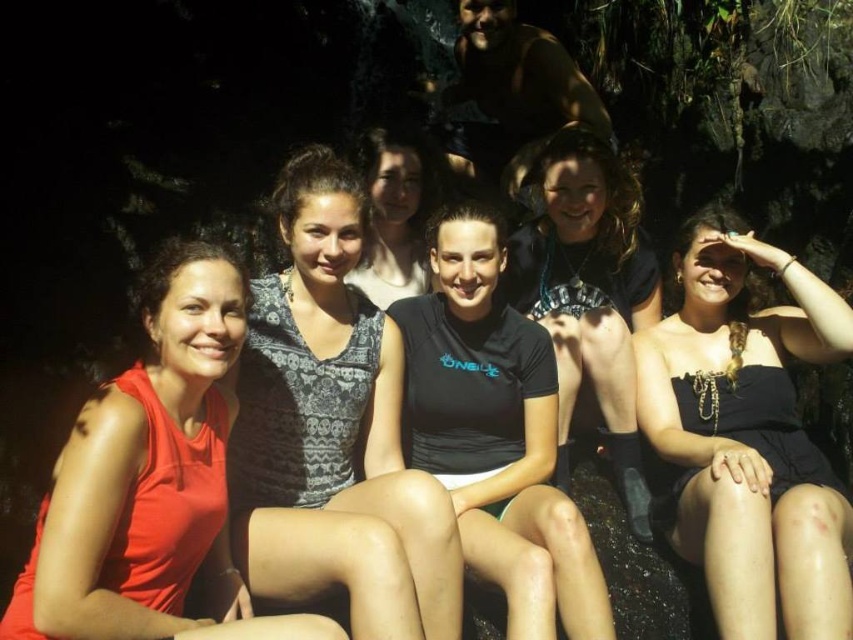
Does patterned fabric dress at center have a smaller size compared to matte black tank top at center?

No, patterned fabric dress at center is not smaller than matte black tank top at center.

How distant is patterned fabric dress at center from matte black tank top at center?

patterned fabric dress at center is 39.16 inches away from matte black tank top at center.

The image size is (853, 640). I want to click on patterned fabric dress at center, so click(x=334, y=432).

Can you confirm if black satin dress at lower right is positioned to the right of matte black tank top at center?

Yes, black satin dress at lower right is to the right of matte black tank top at center.

Based on the photo, which of these two, black satin dress at lower right or matte black tank top at center, stands shorter?

matte black tank top at center is shorter.

Describe the element at coordinates (747, 436) in the screenshot. This screenshot has height=640, width=853. I see `black satin dress at lower right` at that location.

The width and height of the screenshot is (853, 640). What are the coordinates of `black satin dress at lower right` in the screenshot? It's located at (747, 436).

Between matte red tank top at left and matte black tank top at center, which one is positioned higher?

matte black tank top at center is higher up.

Is matte red tank top at left thinner than matte black tank top at center?

No, matte red tank top at left is not thinner than matte black tank top at center.

The width and height of the screenshot is (853, 640). Describe the element at coordinates (148, 477) in the screenshot. I see `matte red tank top at left` at that location.

Image resolution: width=853 pixels, height=640 pixels. In order to click on matte red tank top at left in this screenshot , I will do `click(148, 477)`.